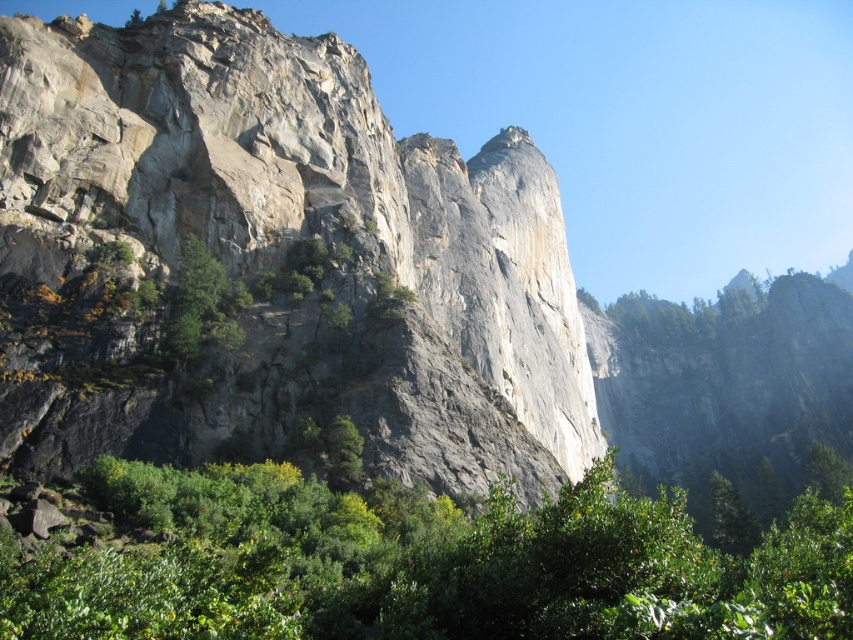
Question: Does green leafy shrubs at lower center have a greater width compared to green leafy tree at upper center?

Choices:
 (A) no
 (B) yes

Answer: (B)

Question: Which of the following is the closest to the observer?

Choices:
 (A) green matte tree at lower right
 (B) green leafy shrubs at lower center

Answer: (B)

Question: Considering the relative positions of gray rock formation at center and green leafy shrubs at lower center in the image provided, where is gray rock formation at center located with respect to green leafy shrubs at lower center?

Choices:
 (A) above
 (B) below

Answer: (A)

Question: Which is farther from the gray rock formation at center?

Choices:
 (A) green leafy tree at upper center
 (B) green matte tree at left

Answer: (A)

Question: Among these points, which one is nearest to the camera?

Choices:
 (A) click(178, 330)
 (B) click(733, 515)
 (C) click(140, 17)
 (D) click(244, 116)

Answer: (A)

Question: Is gray rock formation at center below green leafy shrubs at lower center?

Choices:
 (A) yes
 (B) no

Answer: (B)